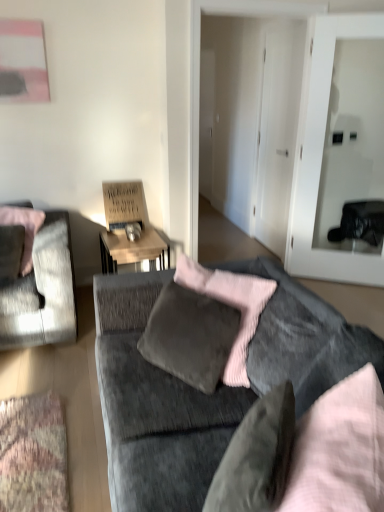
Question: Looking at the image, does velvet gray couch at center seem bigger or smaller compared to velvet gray pillow at center, which ranks as the 1th pillow in front-to-back order?

Choices:
 (A) big
 (B) small

Answer: (A)

Question: In the image, is velvet gray couch at center on the left side or the right side of velvet gray pillow at center, which is the 1th pillow in bottom-to-top order?

Choices:
 (A) left
 (B) right

Answer: (B)

Question: Which object is the farthest from the velvet gray couch at center?

Choices:
 (A) pink velvet pillow at left, marked as the 2th pillow in a right-to-left arrangement
 (B) velvet gray pillow at center, which ranks as the 1th pillow in front-to-back order
 (C) velvet grey chair at left
 (D) wooden desk at center
 (E) transparent glass door at center right

Answer: (E)

Question: Which object is the closest to the velvet gray couch at center?

Choices:
 (A) velvet gray pillow at center, which is the 2th pillow in top-to-bottom order
 (B) wooden desk at center
 (C) transparent glass door at center right
 (D) pink velvet pillow at left, marked as the 2th pillow in a right-to-left arrangement
 (E) velvet grey chair at left

Answer: (A)